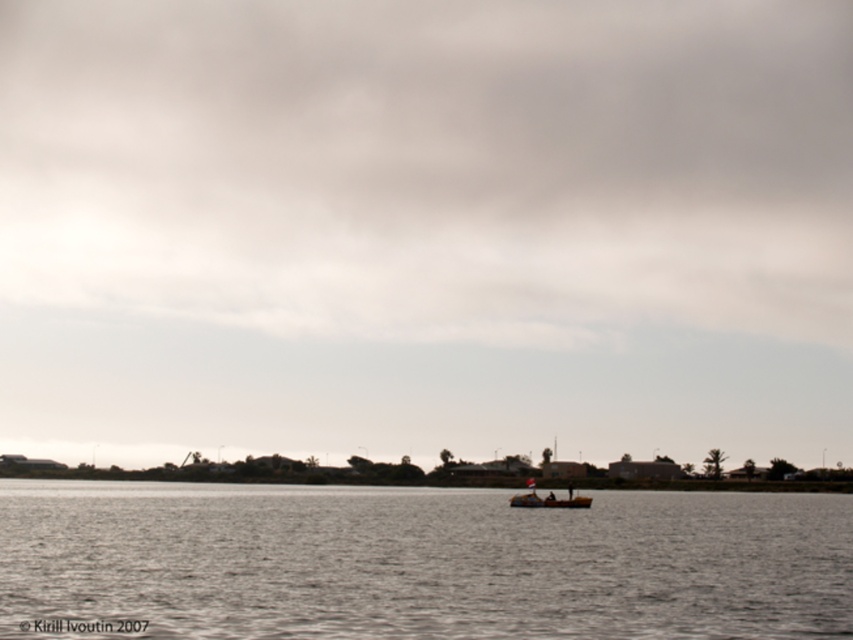
Does gray water at center have a lesser width compared to wooden boat at center?

Incorrect, gray water at center's width is not less than wooden boat at center's.

Who is more distant from viewer, (291,532) or (569,486)?

Point (569,486)

The height and width of the screenshot is (640, 853). I want to click on gray water at center, so click(416, 563).

Which is more to the left, matte gray sky at center or wooden boat at center?

From the viewer's perspective, matte gray sky at center appears more on the left side.

Which of these two, matte gray sky at center or wooden boat at center, stands shorter?

wooden boat at center is shorter.

Describe the element at coordinates (425, 228) in the screenshot. I see `matte gray sky at center` at that location.

Where is `matte gray sky at center`? matte gray sky at center is located at coordinates [x=425, y=228].

Who is shorter, matte gray sky at center or gray water at center?

Standing shorter between the two is gray water at center.

Does point (531, 340) come behind point (608, 564)?

Yes, it is behind point (608, 564).

Image resolution: width=853 pixels, height=640 pixels. I want to click on matte gray sky at center, so click(x=425, y=228).